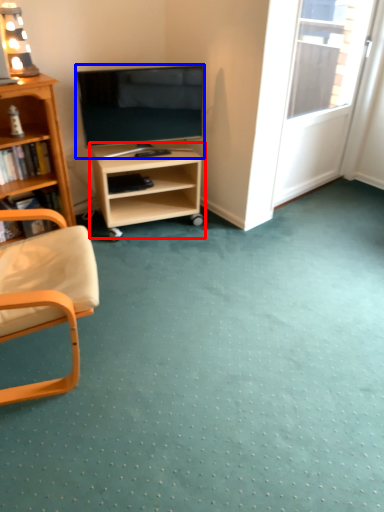
Question: Which of the following is the closest to the observer, shelf (highlighted by a red box) or television (highlighted by a blue box)?

Choices:
 (A) shelf
 (B) television

Answer: (B)